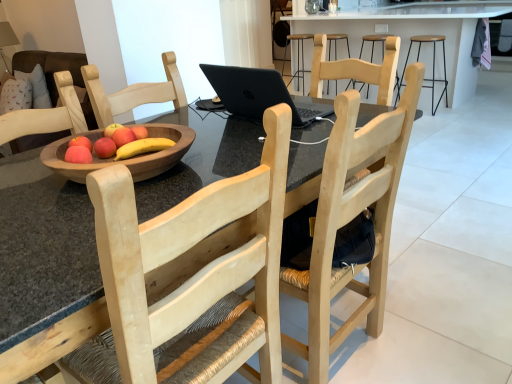
Question: Is black metal stool at upper right bigger or smaller than matte wooden apple at center?

Choices:
 (A) big
 (B) small

Answer: (A)

Question: In the image, is black metal stool at upper right positioned in front of or behind matte wooden apple at center?

Choices:
 (A) front
 (B) behind

Answer: (B)

Question: Estimate the real-world distances between objects in this image. Which object is farther from the natural wood chair at center, which appears as the 1th chair when viewed from the right?

Choices:
 (A) black glossy table at center
 (B) matte wooden apple at center
 (C) metallic black bar stool at center
 (D) natural wood chair at center, the first chair in the left-to-right sequence
 (E) black matte laptop at center

Answer: (C)

Question: Estimate the real-world distances between objects in this image. Which object is farther from the natural wood chair at center, which is the 2th chair in right-to-left order?

Choices:
 (A) black metal stool at upper right
 (B) metallic black bar stool at center
 (C) black matte laptop at center
 (D) natural wood chair at center, which appears as the 1th chair when viewed from the right
 (E) matte wooden apple at center

Answer: (B)